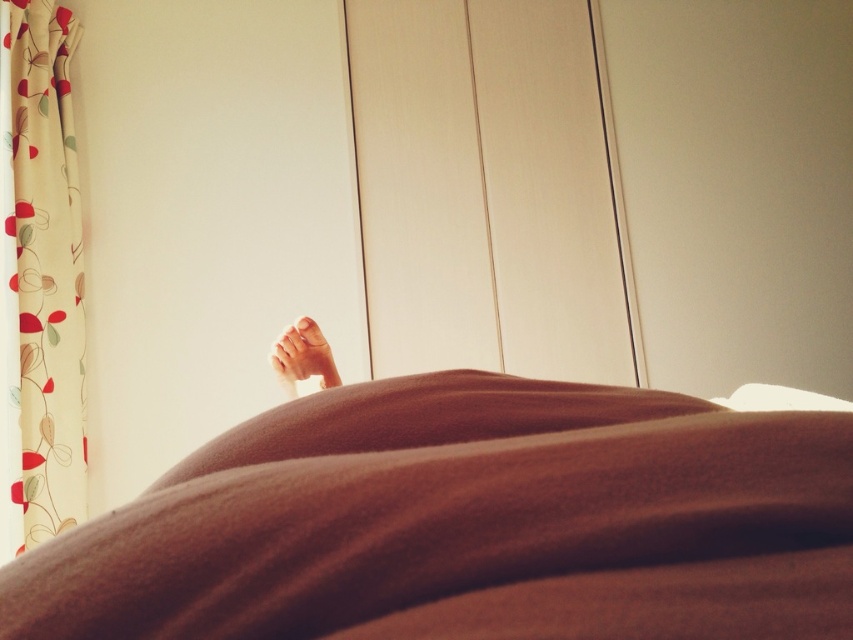
Question: Which object appears closest to the camera in this image?

Choices:
 (A) smooth skin foot at center
 (B) floral fabric curtain at left
 (C) brown soft fabric at lower center

Answer: (C)

Question: Can you confirm if brown soft fabric at lower center is positioned below smooth skin foot at center?

Choices:
 (A) no
 (B) yes

Answer: (B)

Question: Is brown soft fabric at lower center smaller than floral fabric curtain at left?

Choices:
 (A) no
 (B) yes

Answer: (B)

Question: Which point is farther from the camera taking this photo?

Choices:
 (A) (51, 136)
 (B) (374, 627)
 (C) (323, 369)

Answer: (A)

Question: Does floral fabric curtain at left appear on the right side of smooth skin foot at center?

Choices:
 (A) no
 (B) yes

Answer: (A)

Question: Among these points, which one is farthest from the camera?

Choices:
 (A) (328, 358)
 (B) (77, 308)
 (C) (680, 636)

Answer: (B)